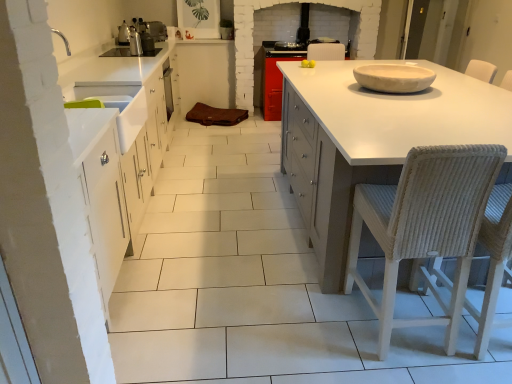
Locate an element on the screen. This screenshot has width=512, height=384. metallic stainless steel kettle at upper left is located at coordinates (135, 42).

Locate an element on the screen. Image resolution: width=512 pixels, height=384 pixels. woven straw chair at right, arranged as the first chair when viewed from the right is located at coordinates (494, 262).

This screenshot has height=384, width=512. What do you see at coordinates (394, 78) in the screenshot? I see `white ceramic bowl at upper right` at bounding box center [394, 78].

How much space does woven wicker chair at right, which appears as the second chair when viewed from the right, occupy horizontally?

woven wicker chair at right, which appears as the second chair when viewed from the right, is 20.08 inches in width.

The image size is (512, 384). What do you see at coordinates (425, 228) in the screenshot? I see `woven wicker chair at right, which appears as the second chair when viewed from the right` at bounding box center [425, 228].

The height and width of the screenshot is (384, 512). Find the location of `metallic stainless steel kettle at upper left`. metallic stainless steel kettle at upper left is located at coordinates (135, 42).

Which is in front, point (302, 210) or point (492, 282)?

The point (492, 282) is closer to the camera.

Can you confirm if white matte countertop at center is shorter than woven straw chair at right, the 2th chair when ordered from left to right?

Indeed, white matte countertop at center has a lesser height compared to woven straw chair at right, the 2th chair when ordered from left to right.

Between white matte countertop at center and woven straw chair at right, the 2th chair when ordered from left to right, which one is positioned behind?

white matte countertop at center is further from the camera.

Considering the relative sizes of white matte countertop at center and woven straw chair at right, arranged as the first chair when viewed from the right, in the image provided, is white matte countertop at center smaller than woven straw chair at right, arranged as the first chair when viewed from the right,?

Incorrect, white matte countertop at center is not smaller in size than woven straw chair at right, arranged as the first chair when viewed from the right.

From the image's perspective, is white matte countertop at center below white ceramic bowl at upper right?

Yes.

Is white matte countertop at center not close to white ceramic bowl at upper right?

No, there isn't a large distance between white matte countertop at center and white ceramic bowl at upper right.

In the image, is white matte countertop at center positioned in front of or behind white ceramic bowl at upper right?

Visually, white matte countertop at center is located in front of white ceramic bowl at upper right.

From a real-world perspective, is white ceramic bowl at upper right on top of woven straw chair at right, arranged as the first chair when viewed from the right?

Yes, from a real-world perspective, white ceramic bowl at upper right is on top of woven straw chair at right, arranged as the first chair when viewed from the right.

You are a GUI agent. You are given a task and a screenshot of the screen. Output one action in this format:
    pyautogui.click(x=<x>, y=<y>)
    Task: Click on the bowl positioned vertically above the woven straw chair at right, the 2th chair when ordered from left to right (from a real-world perspective)
    The height and width of the screenshot is (384, 512).
    Given the screenshot: What is the action you would take?
    pyautogui.click(x=394, y=78)

Is white ceramic bowl at upper right inside or outside of woven straw chair at right, arranged as the first chair when viewed from the right?

white ceramic bowl at upper right cannot be found inside woven straw chair at right, arranged as the first chair when viewed from the right.

Can you confirm if white ceramic bowl at upper right is bigger than woven straw chair at right, the 2th chair when ordered from left to right?

No, white ceramic bowl at upper right is not bigger than woven straw chair at right, the 2th chair when ordered from left to right.

You are a GUI agent. You are given a task and a screenshot of the screen. Output one action in this format:
    pyautogui.click(x=<x>, y=<y>)
    Task: Click on the 2nd chair positioned above the white matte countertop at center (from a real-world perspective)
    This screenshot has width=512, height=384.
    Given the screenshot: What is the action you would take?
    pyautogui.click(x=425, y=228)

From the image's perspective, which is above, woven wicker chair at right, arranged as the first chair when viewed from the left, or white matte countertop at center?

From the image's view, white matte countertop at center is above.

From their relative heights in the image, would you say woven wicker chair at right, which appears as the second chair when viewed from the right, is taller or shorter than white matte countertop at center?

Clearly, woven wicker chair at right, which appears as the second chair when viewed from the right, is taller compared to white matte countertop at center.

From the picture: How distant is woven wicker chair at right, which appears as the second chair when viewed from the right, from white matte countertop at center?

52.50 centimeters.

Considering the relative positions of woven straw chair at right, arranged as the first chair when viewed from the right, and white ceramic bowl at upper right in the image provided, is woven straw chair at right, arranged as the first chair when viewed from the right, to the left of white ceramic bowl at upper right from the viewer's perspective?

In fact, woven straw chair at right, arranged as the first chair when viewed from the right, is to the right of white ceramic bowl at upper right.

Based on their sizes in the image, would you say woven straw chair at right, the 2th chair when ordered from left to right, is bigger or smaller than white ceramic bowl at upper right?

Clearly, woven straw chair at right, the 2th chair when ordered from left to right, is larger in size than white ceramic bowl at upper right.

In terms of width, does woven straw chair at right, the 2th chair when ordered from left to right, look wider or thinner when compared to white ceramic bowl at upper right?

In the image, woven straw chair at right, the 2th chair when ordered from left to right, appears to be more narrow than white ceramic bowl at upper right.

What are the coordinates of `bowl above the woven straw chair at right, arranged as the first chair when viewed from the right (from a real-world perspective)` in the screenshot? It's located at (394, 78).

Which of these two, white matte countertop at center or woven wicker chair at right, which appears as the second chair when viewed from the right, is smaller?

woven wicker chair at right, which appears as the second chair when viewed from the right, is smaller.

From the image's perspective, is white matte countertop at center on top of woven wicker chair at right, which appears as the second chair when viewed from the right?

Yes, from the image's perspective, white matte countertop at center is above woven wicker chair at right, which appears as the second chair when viewed from the right.

At what (x,y) coordinates should I click in order to perform the action: click on countertop on the right of the woven wicker chair at right, which appears as the second chair when viewed from the right. Please return your answer as a coordinate pair (x, y). The width and height of the screenshot is (512, 384). Looking at the image, I should click on (382, 139).

Which object is closer to the camera, white ceramic bowl at upper right or metallic stainless steel kettle at upper left?

white ceramic bowl at upper right is in front.

In terms of size, does white ceramic bowl at upper right appear bigger or smaller than metallic stainless steel kettle at upper left?

Considering their sizes, white ceramic bowl at upper right takes up more space than metallic stainless steel kettle at upper left.

From a real-world perspective, who is located lower, white ceramic bowl at upper right or metallic stainless steel kettle at upper left?

white ceramic bowl at upper right, from a real-world perspective.

This screenshot has width=512, height=384. I want to click on the 1st chair directly above the white matte countertop at center (from a real-world perspective), so click(x=494, y=262).

You are a GUI agent. You are given a task and a screenshot of the screen. Output one action in this format:
    pyautogui.click(x=<x>, y=<y>)
    Task: Click on the bowl above the white matte countertop at center (from the image's perspective)
    The height and width of the screenshot is (384, 512).
    Given the screenshot: What is the action you would take?
    pyautogui.click(x=394, y=78)

From the image, which object appears to be nearer to woven wicker chair at right, arranged as the first chair when viewed from the left, woven straw chair at right, the 2th chair when ordered from left to right, or white matte countertop at center?

Based on the image, woven straw chair at right, the 2th chair when ordered from left to right, appears to be nearer to woven wicker chair at right, arranged as the first chair when viewed from the left.

From the image, which object appears to be nearer to white matte countertop at center, woven wicker chair at right, which appears as the second chair when viewed from the right, or white ceramic bowl at upper right?

white ceramic bowl at upper right lies closer to white matte countertop at center than the other object.

Estimate the real-world distances between objects in this image. Which object is further from white ceramic bowl at upper right, woven straw chair at right, arranged as the first chair when viewed from the right, or white matte countertop at center?

woven straw chair at right, arranged as the first chair when viewed from the right, is positioned further to the anchor white ceramic bowl at upper right.

Considering their positions, is metallic stainless steel kettle at upper left positioned closer to woven wicker chair at right, arranged as the first chair when viewed from the left, than woven straw chair at right, the 2th chair when ordered from left to right?

Among the two, woven straw chair at right, the 2th chair when ordered from left to right, is located nearer to woven wicker chair at right, arranged as the first chair when viewed from the left.

When comparing their distances from white ceramic bowl at upper right, does woven wicker chair at right, which appears as the second chair when viewed from the right, or white matte countertop at center seem further?

Based on the image, woven wicker chair at right, which appears as the second chair when viewed from the right, appears to be further to white ceramic bowl at upper right.

From the image, which object appears to be nearer to white ceramic bowl at upper right, woven wicker chair at right, arranged as the first chair when viewed from the left, or woven straw chair at right, the 2th chair when ordered from left to right?

Based on the image, woven straw chair at right, the 2th chair when ordered from left to right, appears to be nearer to white ceramic bowl at upper right.

When comparing their distances from white matte countertop at center, does metallic stainless steel kettle at upper left or white ceramic bowl at upper right seem closer?

white ceramic bowl at upper right is positioned closer to the anchor white matte countertop at center.

From the image, which object appears to be nearer to metallic stainless steel kettle at upper left, white matte countertop at center or woven wicker chair at right, arranged as the first chair when viewed from the left?

white matte countertop at center lies closer to metallic stainless steel kettle at upper left than the other object.

At what (x,y) coordinates should I click in order to perform the action: click on bowl between metallic stainless steel kettle at upper left and woven straw chair at right, the 2th chair when ordered from left to right, from left to right. Please return your answer as a coordinate pair (x, y). Looking at the image, I should click on (394, 78).

Identify the location of bowl between woven wicker chair at right, arranged as the first chair when viewed from the left, and metallic stainless steel kettle at upper left in the front-back direction. Image resolution: width=512 pixels, height=384 pixels. (394, 78).

In order to click on chair between woven wicker chair at right, which appears as the second chair when viewed from the right, and metallic stainless steel kettle at upper left in the front-back direction in this screenshot , I will do `click(494, 262)`.

You are a GUI agent. You are given a task and a screenshot of the screen. Output one action in this format:
    pyautogui.click(x=<x>, y=<y>)
    Task: Click on the chair positioned between woven wicker chair at right, which appears as the second chair when viewed from the right, and white ceramic bowl at upper right from near to far
    This screenshot has width=512, height=384.
    Given the screenshot: What is the action you would take?
    pyautogui.click(x=494, y=262)